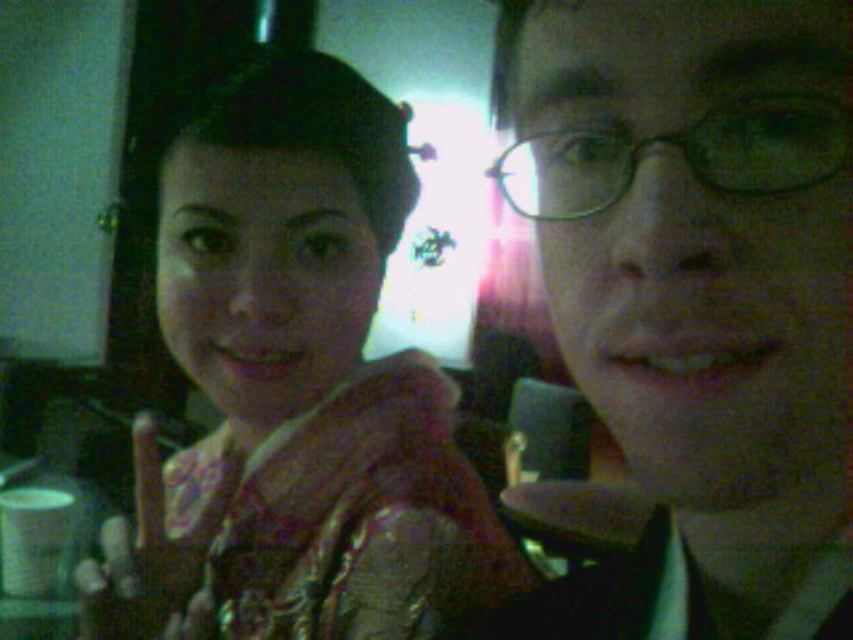
You are standing in the room where the selfie was taken. You want to move from the point at coordinates point (807,385) to the point at coordinates point (257,260). Which direction should you move?

Since point (807,385) is in front of point (257,260), you should move backward to reach point (257,260).

You are trying to locate the matte black glasses at center in a low resolution image. Given that the image coordinate system has its origin at the bottom left corner, with x increasing to the right and y increasing upwards, can you determine if the glasses are positioned closer to the top or bottom half of the image?

The 2D location of matte black glasses at center is at point (695, 301). Since the y coordinate is 0.816, which is above 0.5, the glasses are positioned closer to the top half of the image.

You are a photographer trying to adjust the focus of your camera. You want to ensure both the matte black glasses at center and the shiny gold dress at center are in focus. Given their heights, which object should you focus on first to achieve this?

The matte black glasses at center is shorter than the shiny gold dress at center. To get both in focus, you should focus on the shiny gold dress at center first since it is taller and will help set the focal plane for the shorter object.